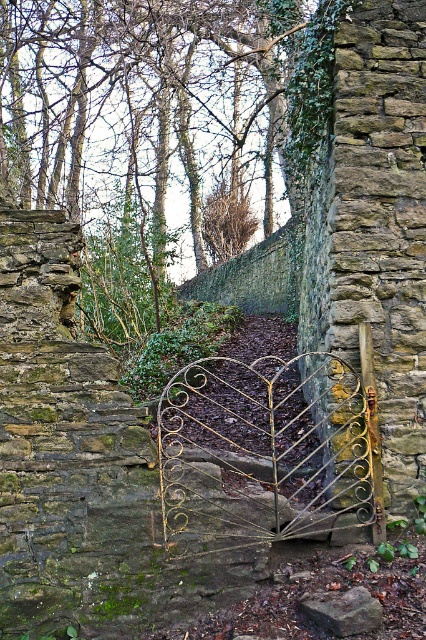
Question: Does gold wrought iron gate at center appear on the left side of brown rough stone at center?

Choices:
 (A) yes
 (B) no

Answer: (A)

Question: Which of the following is the farthest from the observer?

Choices:
 (A) brown rough stone at center
 (B) gold wrought iron gate at center

Answer: (B)

Question: Is gold wrought iron gate at center thinner than brown rough stone at center?

Choices:
 (A) yes
 (B) no

Answer: (B)

Question: Which object is farther from the camera taking this photo?

Choices:
 (A) brown rough stone at center
 (B) gold wrought iron gate at center

Answer: (B)

Question: Is gold wrought iron gate at center thinner than brown rough stone at center?

Choices:
 (A) no
 (B) yes

Answer: (A)

Question: Which of the following is the closest to the observer?

Choices:
 (A) (316, 612)
 (B) (324, 508)

Answer: (A)